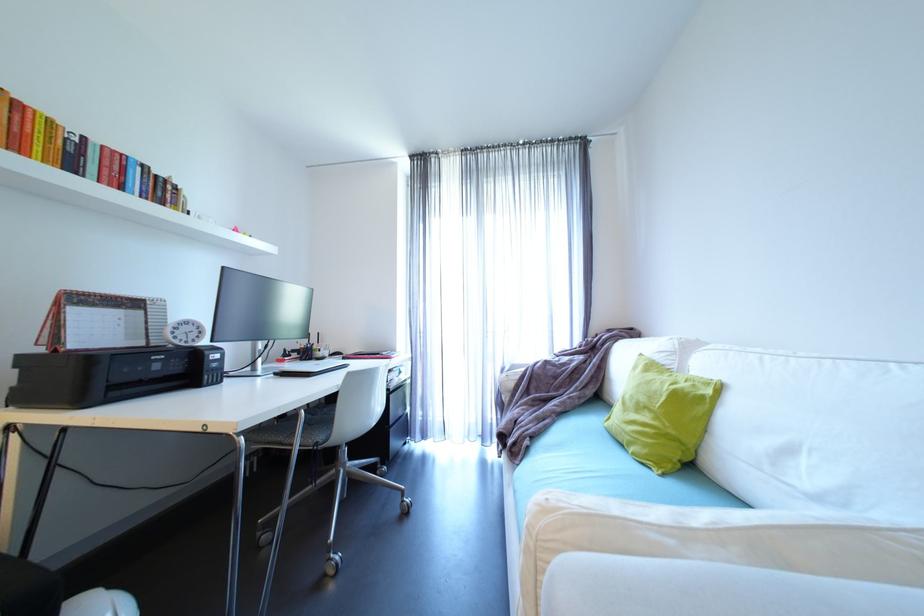
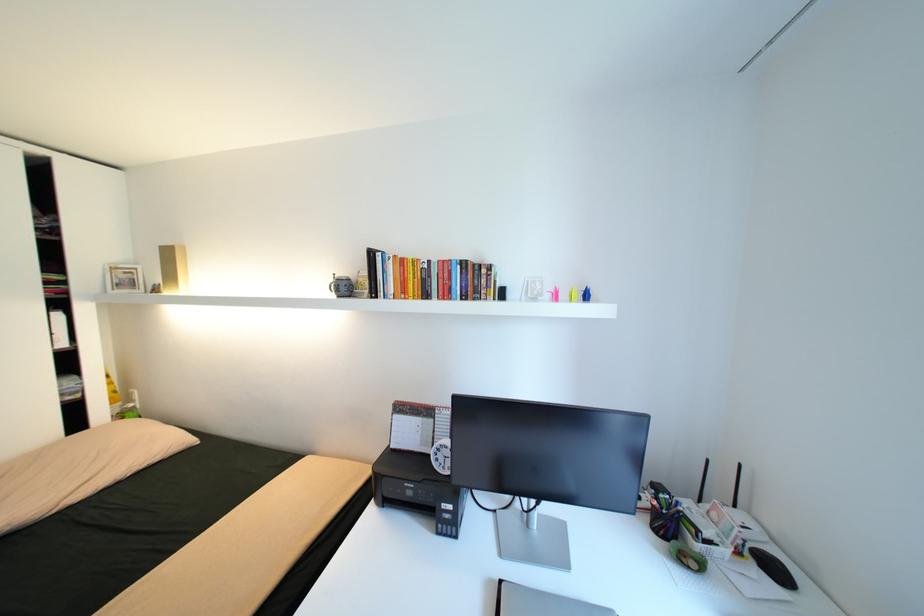
In the second image, find the point that corresponds to [156,302] in the first image.

(444, 411)